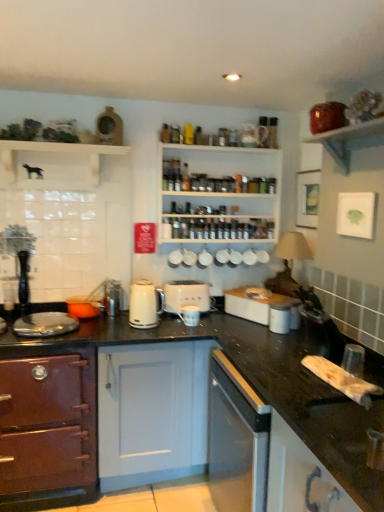
Locate an element on the screen. spots to the right of porcelain matte mug at center, acting as the 2th appliance starting from the right is located at coordinates (231, 325).